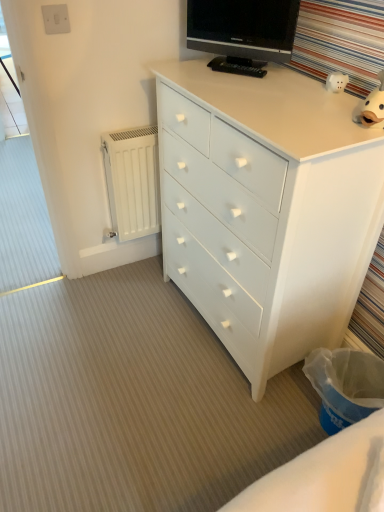
Where is `vacant area situated to the left side of white glossy piggy bank at upper right`? Image resolution: width=384 pixels, height=512 pixels. vacant area situated to the left side of white glossy piggy bank at upper right is located at coordinates (294, 88).